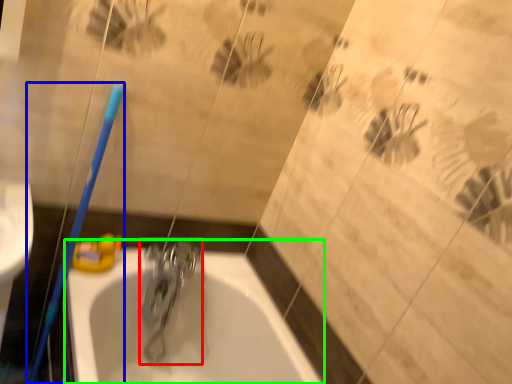
Question: Considering the real-world distances, which object is farthest from tap (highlighted by a red box)? toothbrush (highlighted by a blue box) or bathtub (highlighted by a green box)?

Choices:
 (A) toothbrush
 (B) bathtub

Answer: (A)